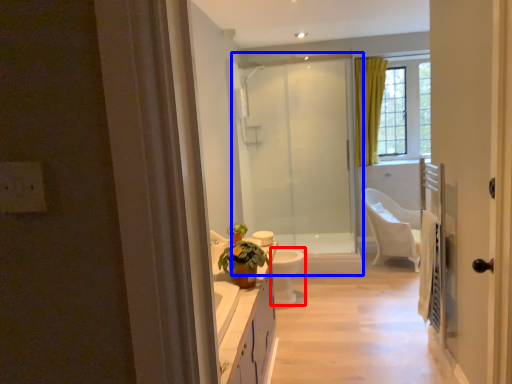
Question: Which of the following is the farthest to the observer, toilet bowl (highlighted by a red box) or screen door (highlighted by a blue box)?

Choices:
 (A) toilet bowl
 (B) screen door

Answer: (B)